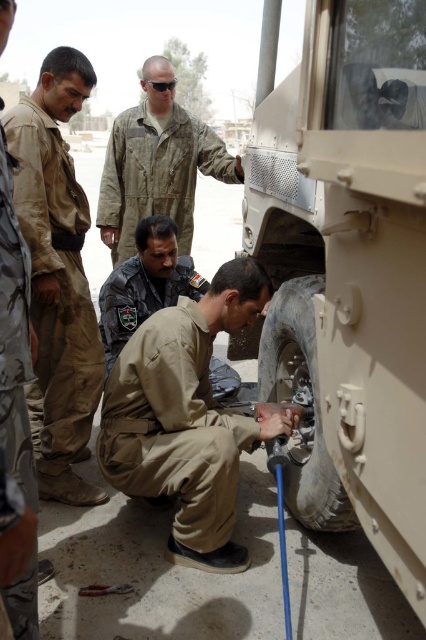
Question: Which object appears closest to the camera in this image?

Choices:
 (A) tan matte tire at lower center
 (B) brown uniform at center
 (C) camouflage fabric uniform at upper center
 (D) brown/cotton uniform at left

Answer: (A)

Question: Is tan matte tire at lower center positioned in front of tan uniform at center?

Choices:
 (A) no
 (B) yes

Answer: (B)

Question: Considering the relative positions of tan matte tire at lower center and tan uniform at center in the image provided, where is tan matte tire at lower center located with respect to tan uniform at center?

Choices:
 (A) above
 (B) below

Answer: (A)

Question: Is camouflage fabric uniform at upper center to the right of gray rubber tire at lower center from the viewer's perspective?

Choices:
 (A) no
 (B) yes

Answer: (A)

Question: Which object appears farthest from the camera in this image?

Choices:
 (A) gray rubber tire at lower center
 (B) camouflage fabric uniform at upper center
 (C) brown uniform at center
 (D) brown/cotton uniform at left

Answer: (B)

Question: Which point appears closest to the camera in this image?

Choices:
 (A) (328, 481)
 (B) (311, 392)
 (C) (138, 160)

Answer: (A)